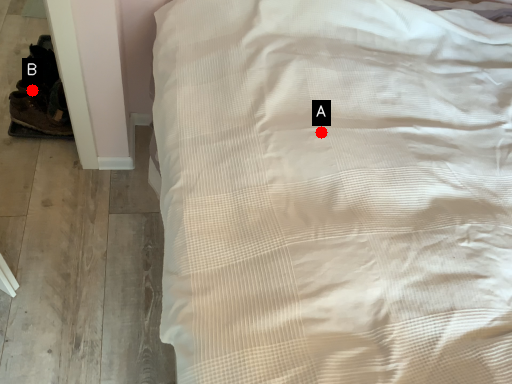
Question: Two points are circled on the image, labeled by A and B beside each circle. Among these points, which one is nearest to the camera?

Choices:
 (A) A is closer
 (B) B is closer

Answer: (A)